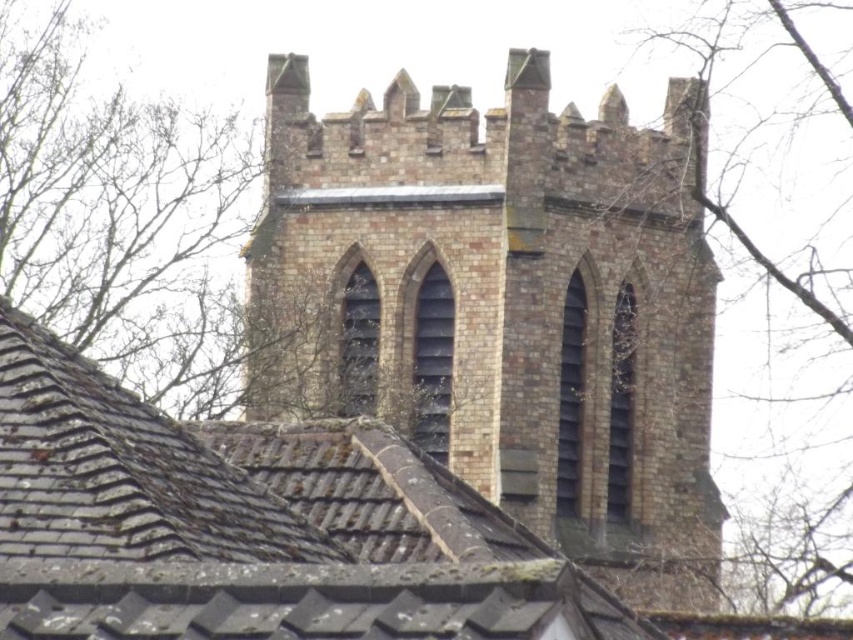
You are standing in front of the building and want to look at the brown tile roof at upper center and the bare branches at upper left. Which object is positioned lower in the image?

The brown tile roof at upper center is located below the bare branches at upper left, so it is positioned lower in the image.

From the picture: You are standing in front of a building and see a point marked at coordinates (503, 305). What does this point correspond to?

The point at coordinates (503, 305) corresponds to the brown brick church at center.